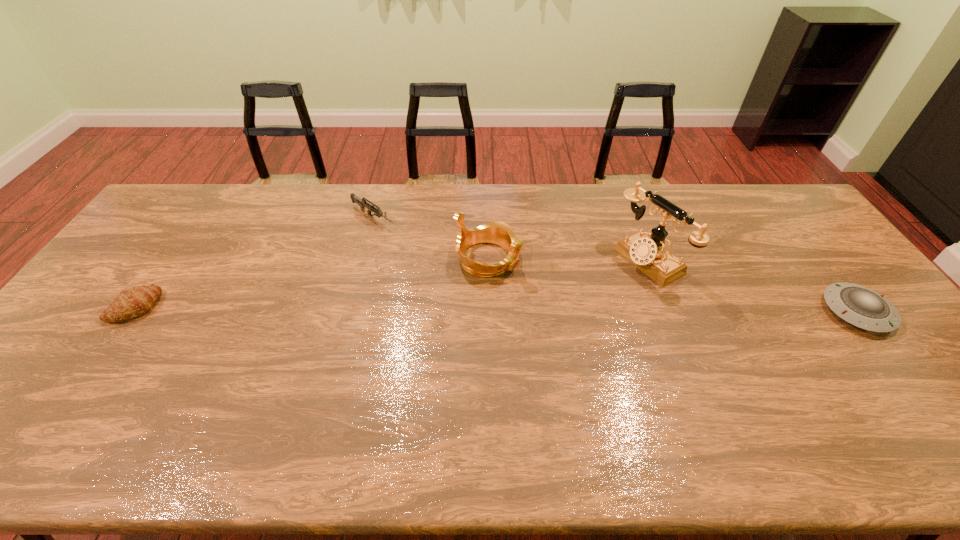
At what (x,y) coordinates should I click in order to perform the action: click on object positioned at the far edge. Please return your answer as a coordinate pair (x, y). Looking at the image, I should click on (362, 203).

Image resolution: width=960 pixels, height=540 pixels. I want to click on object at the left edge, so click(x=134, y=302).

Locate an element on the screen. The width and height of the screenshot is (960, 540). object located in the right edge section of the desktop is located at coordinates (858, 305).

Find the location of a particular element. vacant space at the far edge is located at coordinates (x=572, y=209).

Locate an element on the screen. The image size is (960, 540). free space at the near edge of the desktop is located at coordinates (403, 392).

Identify the location of vacant area at the left edge of the desktop. This screenshot has width=960, height=540. (96, 336).

Where is `free space at the far left corner`? This screenshot has height=540, width=960. free space at the far left corner is located at coordinates (187, 187).

The height and width of the screenshot is (540, 960). Identify the location of vacant space at the near left corner of the desktop. (59, 394).

Image resolution: width=960 pixels, height=540 pixels. Identify the location of vacant area that lies between the rightmost object and the fourth object from right to left. (615, 264).

The image size is (960, 540). Identify the location of empty location between the saucer and the second object from left to right. (615, 264).